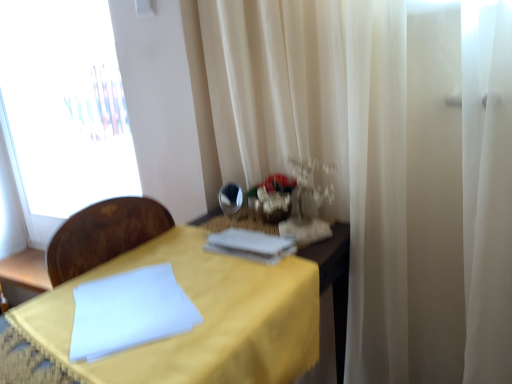
Question: Considering the relative sizes of shiny silver mirror at center and yellow fabric table at center in the image provided, is shiny silver mirror at center thinner than yellow fabric table at center?

Choices:
 (A) yes
 (B) no

Answer: (A)

Question: Is shiny silver mirror at center not near yellow fabric table at center?

Choices:
 (A) no
 (B) yes

Answer: (A)

Question: Is shiny silver mirror at center beside yellow fabric table at center?

Choices:
 (A) yes
 (B) no

Answer: (B)

Question: Does shiny silver mirror at center come in front of yellow fabric table at center?

Choices:
 (A) no
 (B) yes

Answer: (A)

Question: Can you confirm if shiny silver mirror at center is shorter than yellow fabric table at center?

Choices:
 (A) no
 (B) yes

Answer: (B)

Question: Is point (199, 236) closer or farther from the camera than point (225, 200)?

Choices:
 (A) closer
 (B) farther

Answer: (A)

Question: Is yellow fabric table at center to the left or to the right of shiny silver mirror at center in the image?

Choices:
 (A) left
 (B) right

Answer: (A)

Question: Based on their sizes in the image, would you say yellow fabric table at center is bigger or smaller than shiny silver mirror at center?

Choices:
 (A) small
 (B) big

Answer: (B)

Question: From the image's perspective, is yellow fabric table at center above or below shiny silver mirror at center?

Choices:
 (A) above
 (B) below

Answer: (B)

Question: Considering the relative positions of white paper at center and transparent glass window at left in the image provided, is white paper at center to the left or to the right of transparent glass window at left?

Choices:
 (A) left
 (B) right

Answer: (B)

Question: Is white paper at center inside or outside of transparent glass window at left?

Choices:
 (A) outside
 (B) inside

Answer: (A)

Question: Looking at their shapes, would you say white paper at center is wider or thinner than transparent glass window at left?

Choices:
 (A) thin
 (B) wide

Answer: (A)

Question: Considering the positions of point (263, 246) and point (62, 122), is point (263, 246) closer or farther from the camera than point (62, 122)?

Choices:
 (A) farther
 (B) closer

Answer: (B)

Question: Visually, is transparent glass window at left positioned to the left or to the right of white paper at center?

Choices:
 (A) left
 (B) right

Answer: (A)

Question: From the image's perspective, relative to white paper at center, is transparent glass window at left above or below?

Choices:
 (A) below
 (B) above

Answer: (B)